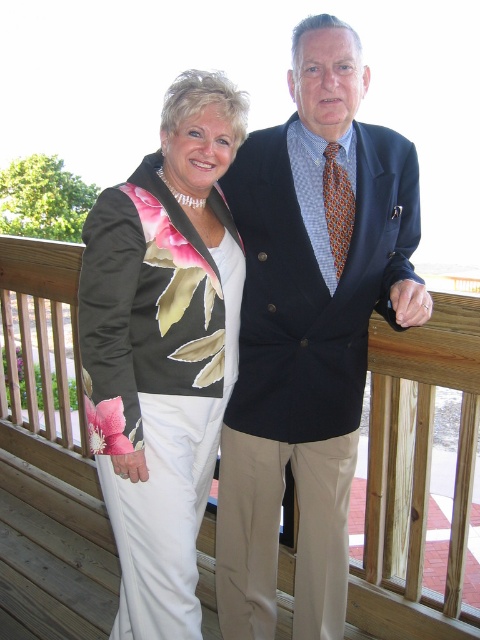
Question: Based on their relative distances, which object is farther from the matte black blazer at center?

Choices:
 (A) dark blue suit at center
 (B) floral-patterned fabric at center

Answer: (A)

Question: Which point is farther from the camera taking this photo?

Choices:
 (A) (347, 131)
 (B) (204, 93)

Answer: (A)

Question: Can you confirm if dark blue suit at center is bigger than floral-patterned fabric at center?

Choices:
 (A) yes
 (B) no

Answer: (A)

Question: Observing the image, what is the correct spatial positioning of dark blue suit at center in reference to floral-patterned fabric at center?

Choices:
 (A) above
 (B) below

Answer: (A)

Question: Which object appears closest to the camera in this image?

Choices:
 (A) matte black blazer at center
 (B) dark blue suit at center

Answer: (B)

Question: Is dark blue suit at center thinner than matte black blazer at center?

Choices:
 (A) no
 (B) yes

Answer: (B)